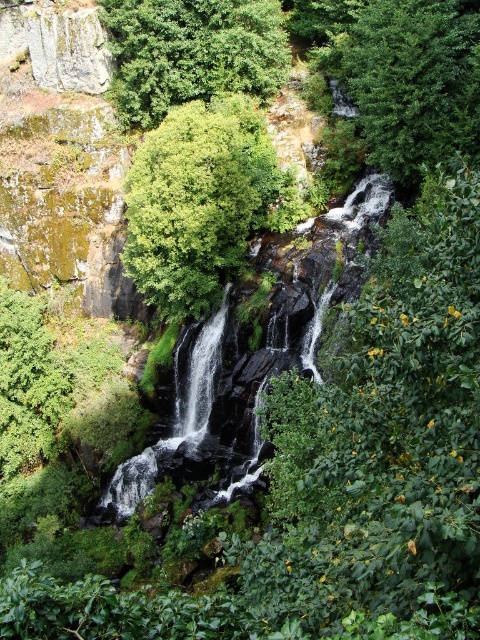
Does smooth rock waterfall at center have a greater height compared to green mossy waterfall at center?

Yes.

Is smooth rock waterfall at center smaller than green mossy waterfall at center?

Incorrect, smooth rock waterfall at center is not smaller in size than green mossy waterfall at center.

Between point (208, 438) and point (183, 419), which one is positioned behind?

The point (183, 419) is behind.

Find the location of a particular element. The width and height of the screenshot is (480, 640). smooth rock waterfall at center is located at coordinates (177, 413).

Does green leafy tree at upper center have a lesser height compared to green mossy waterfall at center?

Yes.

Which is behind, point (143, 90) or point (225, 312)?

The point (143, 90) is more distant.

Between point (227, 20) and point (202, 417), which one is positioned behind?

The point (227, 20) is behind.

This screenshot has width=480, height=640. What are the coordinates of `green leafy tree at upper center` in the screenshot? It's located at (192, 52).

Is the position of green leafy tree at center more distant than that of green leafy tree at upper right?

Yes.

Based on the photo, who is positioned more to the right, green leafy tree at center or green leafy tree at upper right?

Positioned to the right is green leafy tree at upper right.

Between point (240, 212) and point (454, 77), which one is positioned in front?

Positioned in front is point (454, 77).

Identify the location of green leafy tree at center. The height and width of the screenshot is (640, 480). (201, 202).